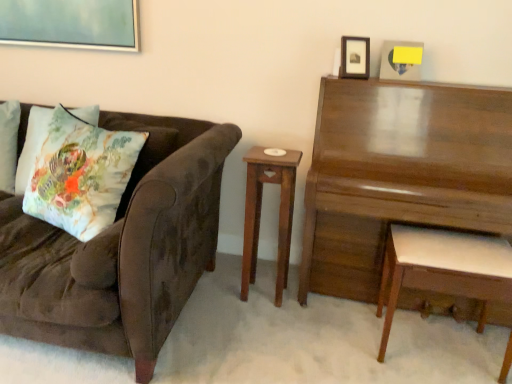
Identify the location of free space in front of wooden picture frame at upper right, marked as the first picture frame in a left-to-right arrangement. Image resolution: width=512 pixels, height=384 pixels. (355, 79).